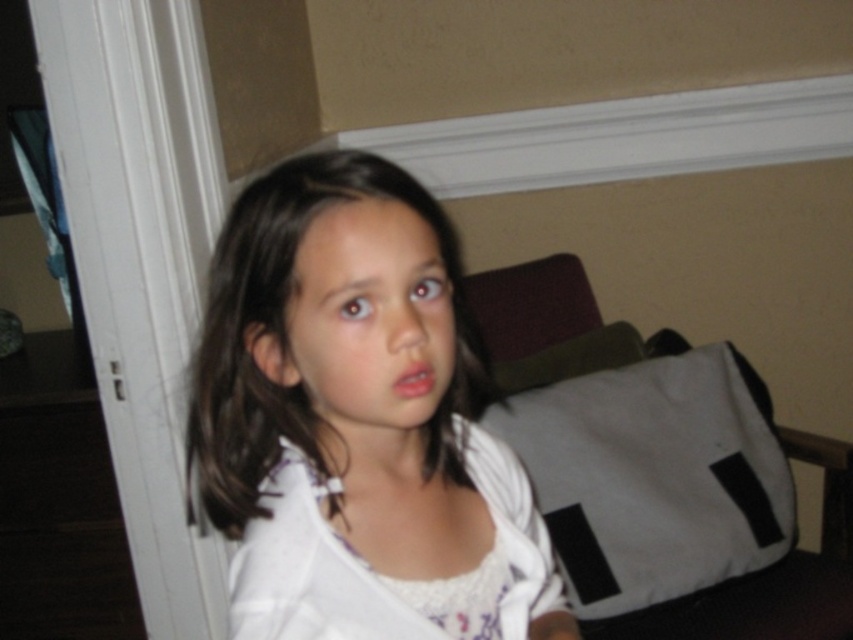
Does smooth white shirt at center have a larger size compared to white textured dress at center?

Yes.

Which is behind, point (311, 328) or point (509, 515)?

Positioned behind is point (509, 515).

Identify the location of smooth white shirt at center. The width and height of the screenshot is (853, 640). (355, 413).